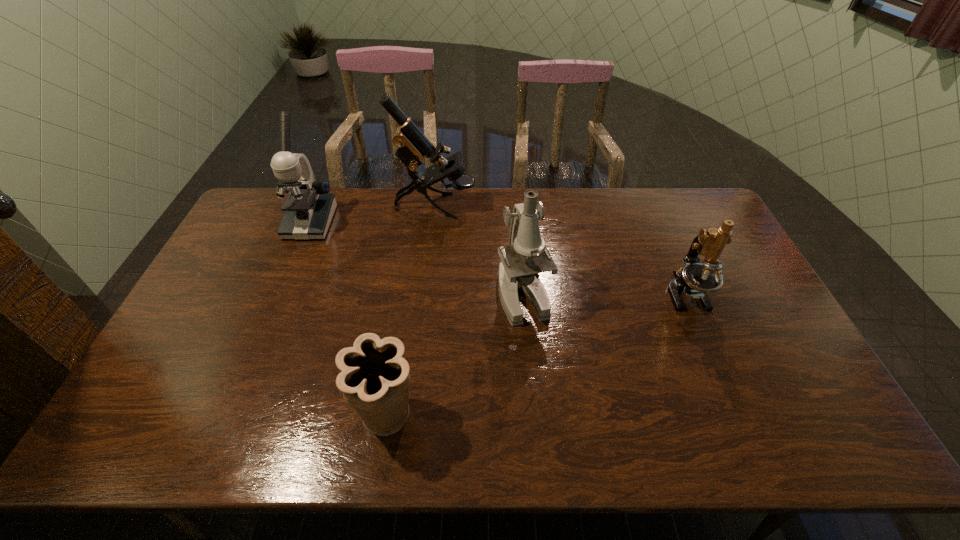
Identify which object is the third closest to the fourth object from left to right. Please provide its 2D coordinates. Your answer should be formatted as a tuple, i.e. [(x, y)], where the tuple contains the x and y coordinates of a point satisfying the conditions above.

[(695, 279)]

This screenshot has width=960, height=540. Identify the location of microscope that is the third closest to the shortest microscope. (309, 207).

Locate an element on the screen. This screenshot has height=540, width=960. microscope object that ranks as the closest to the shortest microscope is located at coordinates (526, 255).

You are a GUI agent. You are given a task and a screenshot of the screen. Output one action in this format:
    pyautogui.click(x=<x>, y=<y>)
    Task: Click on the vacant region that satisfies the following two spatial constraints: 1. on the front side of the leftmost object; 2. on the left side of the second microscope from right to left
    This screenshot has width=960, height=540.
    Given the screenshot: What is the action you would take?
    pyautogui.click(x=279, y=295)

Where is `free space that satisfies the following two spatial constraints: 1. on the back side of the second object from right to left; 2. through the eyepiece of the third microscope from right to left`? This screenshot has height=540, width=960. free space that satisfies the following two spatial constraints: 1. on the back side of the second object from right to left; 2. through the eyepiece of the third microscope from right to left is located at coordinates (515, 206).

At what (x,y) coordinates should I click in order to perform the action: click on free region that satisfies the following two spatial constraints: 1. on the front side of the leftmost object; 2. on the left side of the second object from right to left. Please return your answer as a coordinate pair (x, y). Looking at the image, I should click on (279, 295).